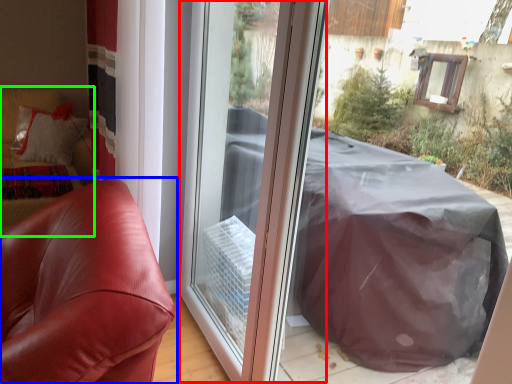
Question: Which object is positioned farthest from screen door (highlighted by a red box)? Select from furniture (highlighted by a blue box) and couch (highlighted by a green box).

Choices:
 (A) furniture
 (B) couch

Answer: (B)